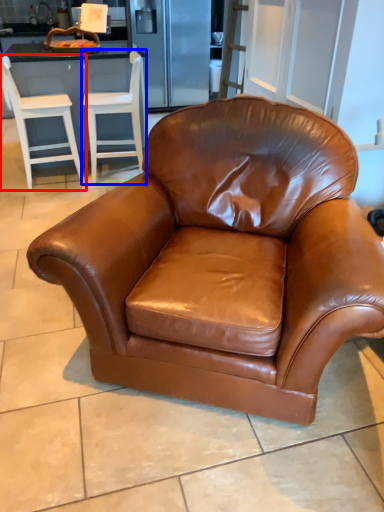
Question: Which object appears closest to the camera in this image, chair (highlighted by a red box) or chair (highlighted by a blue box)?

Choices:
 (A) chair
 (B) chair

Answer: (A)